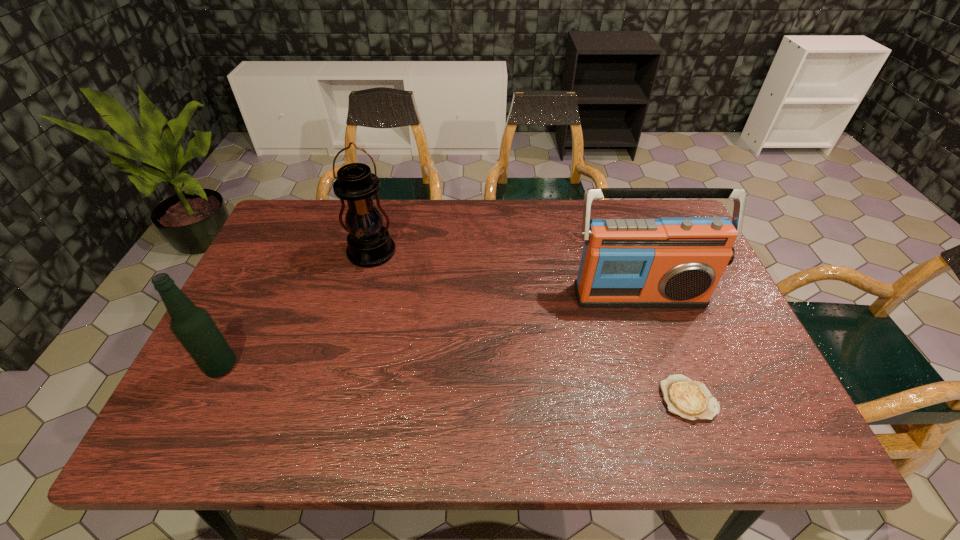
I want to click on object present at the near edge, so click(691, 400).

Where is `object situated at the left edge`? The height and width of the screenshot is (540, 960). object situated at the left edge is located at coordinates (192, 325).

Locate an element on the screen. This screenshot has height=540, width=960. radio receiver that is at the right edge is located at coordinates (672, 262).

Where is `quiche at the right edge`? This screenshot has width=960, height=540. quiche at the right edge is located at coordinates (691, 400).

Locate an element on the screen. This screenshot has width=960, height=540. object that is at the near right corner is located at coordinates (691, 400).

The width and height of the screenshot is (960, 540). Identify the location of vacant space at the far edge of the desktop. (612, 208).

At what (x,y) coordinates should I click in order to perform the action: click on vacant space at the near edge of the desktop. Please return your answer as a coordinate pair (x, y). The height and width of the screenshot is (540, 960). Looking at the image, I should click on (332, 424).

This screenshot has height=540, width=960. In the image, there is a desktop. Find the location of `free space at the left edge`. free space at the left edge is located at coordinates (288, 323).

Identify the location of vacant region at the right edge of the desktop. The image size is (960, 540). (693, 333).

This screenshot has height=540, width=960. What are the coordinates of `vacant space at the far left corner of the desktop` in the screenshot? It's located at (297, 235).